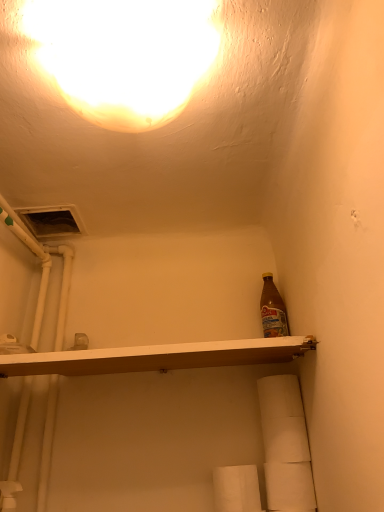
Question: Does white matte toilet paper at lower right, the 4th toilet paper positioned from the bottom, appear on the left side of white paper towel at lower center, placed as the fourth toilet paper when sorted from top to bottom?

Choices:
 (A) yes
 (B) no

Answer: (B)

Question: From the image's perspective, is white matte toilet paper at lower right, the 4th toilet paper positioned from the bottom, on white paper towel at lower center, the first toilet paper positioned from the bottom?

Choices:
 (A) no
 (B) yes

Answer: (B)

Question: Is white matte toilet paper at lower right, marked as the first toilet paper in a top-to-bottom arrangement, not inside white paper towel at lower center, placed as the fourth toilet paper when sorted from top to bottom?

Choices:
 (A) yes
 (B) no

Answer: (A)

Question: Considering the relative positions of white matte toilet paper at lower right, marked as the first toilet paper in a top-to-bottom arrangement, and white paper towel at lower center, placed as the fourth toilet paper when sorted from top to bottom, in the image provided, is white matte toilet paper at lower right, marked as the first toilet paper in a top-to-bottom arrangement, in front of white paper towel at lower center, placed as the fourth toilet paper when sorted from top to bottom,?

Choices:
 (A) yes
 (B) no

Answer: (B)

Question: Can you confirm if white matte toilet paper at lower right, marked as the first toilet paper in a top-to-bottom arrangement, is taller than white paper towel at lower center, placed as the fourth toilet paper when sorted from top to bottom?

Choices:
 (A) yes
 (B) no

Answer: (B)

Question: Considering the positions of white matte toilet paper at lower right, which is the third toilet paper in bottom-to-top order, and white matte toilet paper at lower right, the second toilet paper from the bottom, in the image, is white matte toilet paper at lower right, which is the third toilet paper in bottom-to-top order, taller or shorter than white matte toilet paper at lower right, the second toilet paper from the bottom,?

Choices:
 (A) short
 (B) tall

Answer: (B)

Question: Considering the positions of white matte toilet paper at lower right, which is the third toilet paper in bottom-to-top order, and white matte toilet paper at lower right, the second toilet paper from the bottom, in the image, is white matte toilet paper at lower right, which is the third toilet paper in bottom-to-top order, wider or thinner than white matte toilet paper at lower right, the second toilet paper from the bottom,?

Choices:
 (A) thin
 (B) wide

Answer: (B)

Question: From the image's perspective, is white matte toilet paper at lower right, which is the third toilet paper in bottom-to-top order, located above or below white matte toilet paper at lower right, which is the 3th toilet paper in top-to-bottom order?

Choices:
 (A) below
 (B) above

Answer: (B)

Question: Based on their positions, is white matte toilet paper at lower right, which is the third toilet paper in bottom-to-top order, located to the left or right of white matte toilet paper at lower right, which is the 3th toilet paper in top-to-bottom order?

Choices:
 (A) right
 (B) left

Answer: (B)

Question: In terms of height, does white matte toilet paper at lower right, which is the 2th toilet paper in top-to-bottom order, look taller or shorter compared to white matte toilet paper at lower right, marked as the first toilet paper in a top-to-bottom arrangement?

Choices:
 (A) tall
 (B) short

Answer: (B)

Question: From a real-world perspective, relative to white matte toilet paper at lower right, marked as the first toilet paper in a top-to-bottom arrangement, is white matte toilet paper at lower right, which is the third toilet paper in bottom-to-top order, vertically above or below?

Choices:
 (A) below
 (B) above

Answer: (A)

Question: Does point (269, 421) appear closer or farther from the camera than point (278, 399)?

Choices:
 (A) farther
 (B) closer

Answer: (B)

Question: Is white matte toilet paper at lower right, which is the third toilet paper in bottom-to-top order, wider or thinner than white matte toilet paper at lower right, the 4th toilet paper positioned from the bottom?

Choices:
 (A) thin
 (B) wide

Answer: (A)

Question: In the image, is white matte toilet paper at lower right, marked as the first toilet paper in a top-to-bottom arrangement, on the left side or the right side of white matte toilet paper at lower right, the second toilet paper from the bottom?

Choices:
 (A) right
 (B) left

Answer: (B)

Question: Is white matte toilet paper at lower right, the 4th toilet paper positioned from the bottom, bigger or smaller than white matte toilet paper at lower right, the second toilet paper from the bottom?

Choices:
 (A) big
 (B) small

Answer: (A)